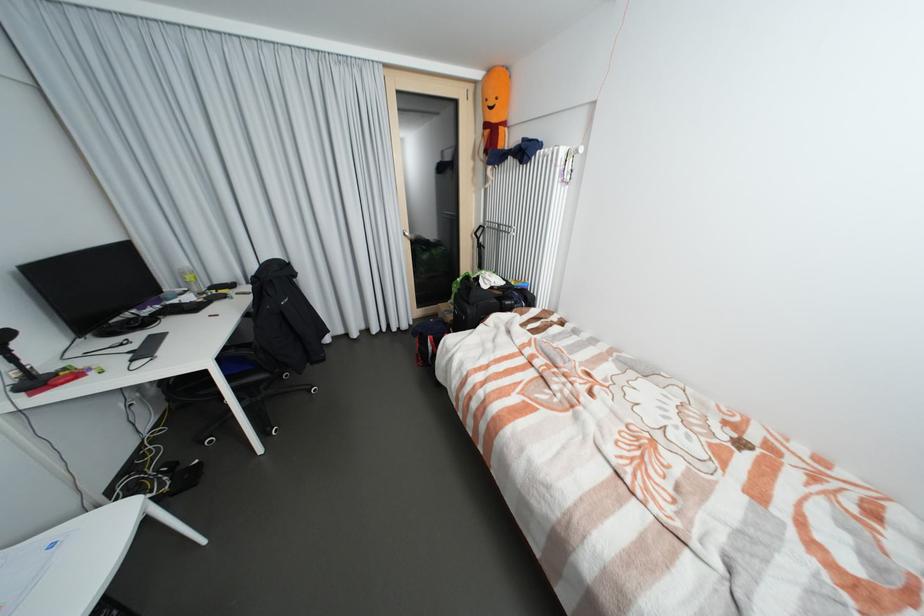
Where is `chair sitting surface`? chair sitting surface is located at coordinates (67, 562).